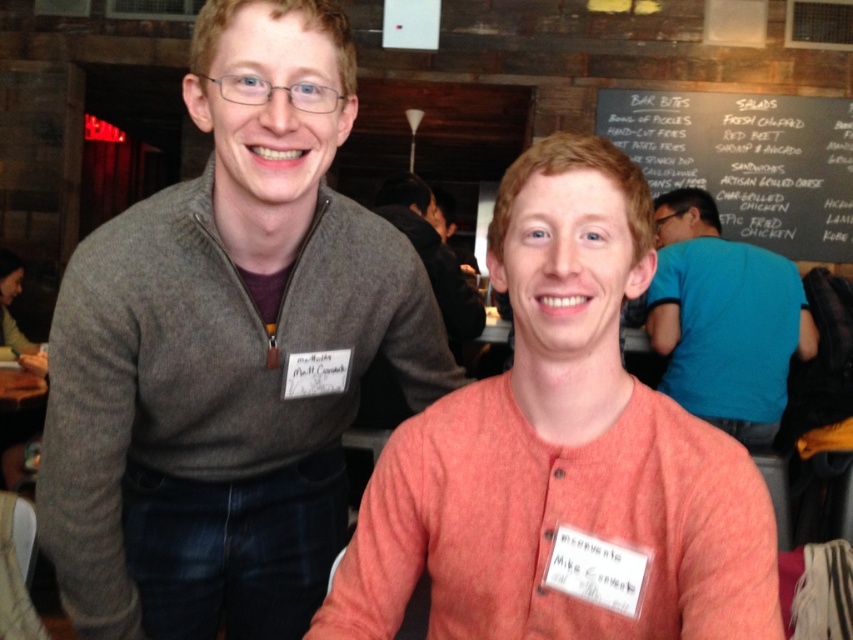
You are a delivery person who needs to place a package between the black chalkboard at upper right and the blue cotton shirt at right. The package is 3 feet wide. Can you fit it in the space between them?

The black chalkboard at upper right and blue cotton shirt at right are 6.36 feet apart from each other, so yes, the package can fit between them since it is narrower than the space available.

You are standing in the dining area and want to check the menu. Where is the black chalkboard at upper right located in relation to the two people?

The black chalkboard at upper right is located at point (746, 161), which is to the upper right of the two people, so it is positioned above and to the right of them.